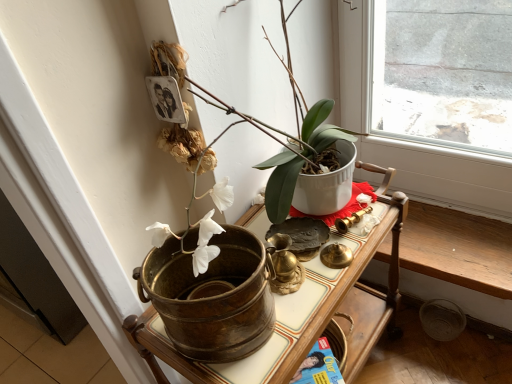
Question: From a real-world perspective, relative to brass textured bucket at center, is white glossy pot at upper center vertically above or below?

Choices:
 (A) below
 (B) above

Answer: (B)

Question: From the image's perspective, is white glossy pot at upper center above or below brass textured bucket at center?

Choices:
 (A) above
 (B) below

Answer: (A)

Question: In terms of height, does white glossy pot at upper center look taller or shorter compared to brass textured bucket at center?

Choices:
 (A) tall
 (B) short

Answer: (B)

Question: Looking at the image, does brass textured bucket at center seem bigger or smaller compared to white glossy pot at upper center?

Choices:
 (A) big
 (B) small

Answer: (A)

Question: From a real-world perspective, is brass textured bucket at center above or below white glossy pot at upper center?

Choices:
 (A) above
 (B) below

Answer: (B)

Question: In the image, is brass textured bucket at center on the left side or the right side of white glossy pot at upper center?

Choices:
 (A) right
 (B) left

Answer: (A)

Question: Relative to white glossy pot at upper center, is brass textured bucket at center in front or behind?

Choices:
 (A) front
 (B) behind

Answer: (B)